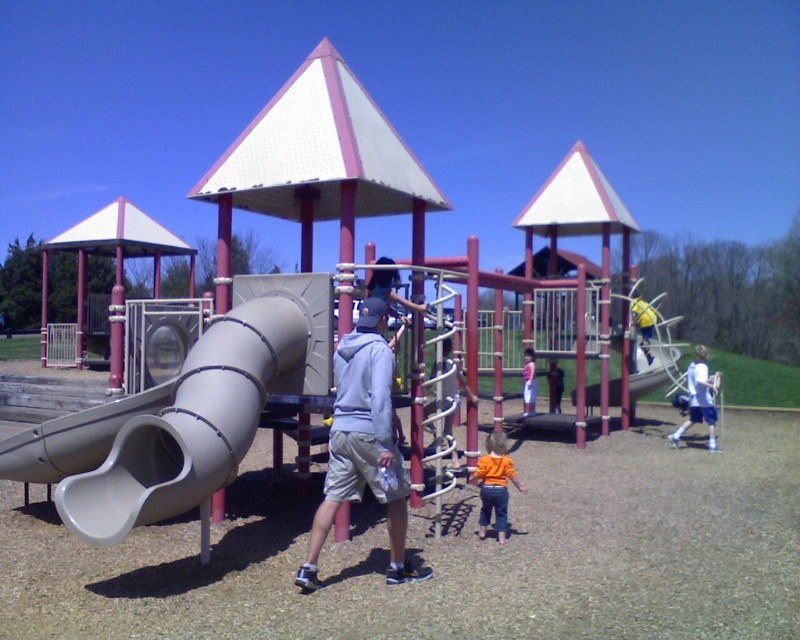
Which is above, gray rubber slide at center or pink fabric dress at center?

gray rubber slide at center is above.

Is point (617, 396) in front of point (534, 374)?

That is False.

Identify the location of gray rubber slide at center. This screenshot has width=800, height=640. (652, 371).

Between gray rubber slide at left and smooth gray slide at center, which one is positioned lower?

smooth gray slide at center is lower down.

Between point (156, 486) and point (121, 404), which one is positioned in front?

Point (156, 486) is in front.

Locate an element on the screen. gray rubber slide at left is located at coordinates (192, 424).

Between orange cotton shirt at center and white jersey at right, which one appears on the right side from the viewer's perspective?

white jersey at right

At what (x,y) coordinates should I click in order to perform the action: click on orange cotton shirt at center. Please return your answer as a coordinate pair (x, y). This screenshot has width=800, height=640. Looking at the image, I should click on 494,484.

The height and width of the screenshot is (640, 800). What do you see at coordinates (494, 484) in the screenshot?
I see `orange cotton shirt at center` at bounding box center [494, 484].

You are a GUI agent. You are given a task and a screenshot of the screen. Output one action in this format:
    pyautogui.click(x=<x>, y=<y>)
    Task: Click on the orange cotton shirt at center
    Image resolution: width=800 pixels, height=640 pixels.
    Given the screenshot: What is the action you would take?
    pyautogui.click(x=494, y=484)